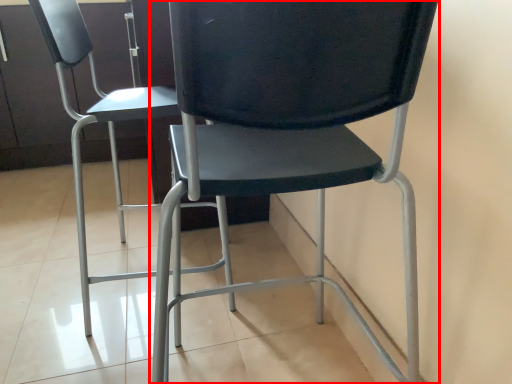
Question: From the image's perspective, what is the correct spatial positioning of chair (annotated by the red box) in reference to chair?

Choices:
 (A) below
 (B) above

Answer: (A)